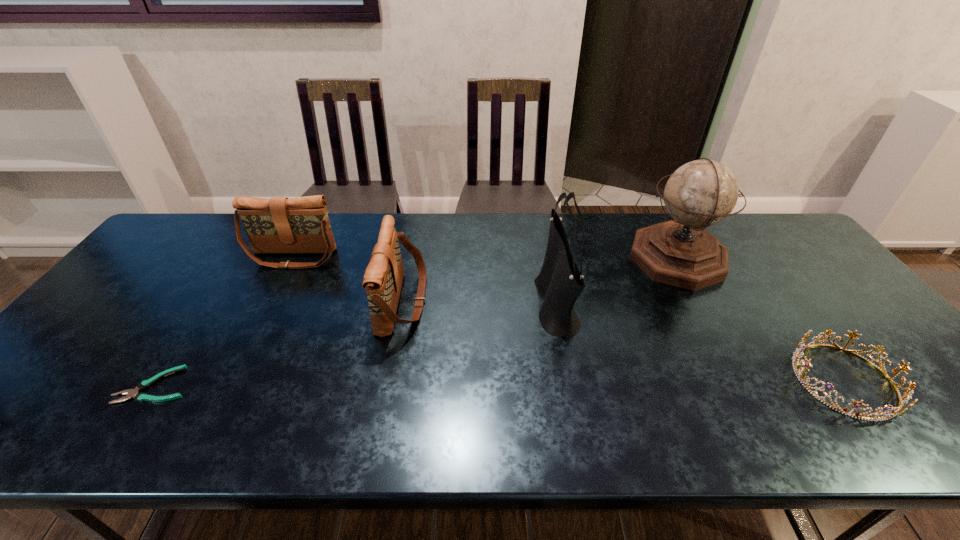
Identify the location of the rightmost shoulder bag. (560, 282).

This screenshot has width=960, height=540. In order to click on the third object from right to left in this screenshot , I will do `click(560, 282)`.

You are a GUI agent. You are given a task and a screenshot of the screen. Output one action in this format:
    pyautogui.click(x=<x>, y=<y>)
    Task: Click on the globe
    The image size is (960, 540).
    Given the screenshot: What is the action you would take?
    pyautogui.click(x=701, y=193)

Find the location of a particular element. The image size is (960, 540). the fourth object from right to left is located at coordinates (x=383, y=278).

Where is `the leftmost shoulder bag`? Image resolution: width=960 pixels, height=540 pixels. the leftmost shoulder bag is located at coordinates (279, 225).

What are the coordinates of `the second shortest object` in the screenshot? It's located at (907, 395).

Locate an element on the screen. The height and width of the screenshot is (540, 960). the shortest object is located at coordinates (131, 393).

Locate an element on the screen. The image size is (960, 540). vacant space located on the front of the tallest shoulder bag is located at coordinates (579, 421).

Where is `free space located 0.050m on the surface of the globe`? The height and width of the screenshot is (540, 960). free space located 0.050m on the surface of the globe is located at coordinates (612, 259).

Identify the location of free space located on the surface of the globe. (607, 259).